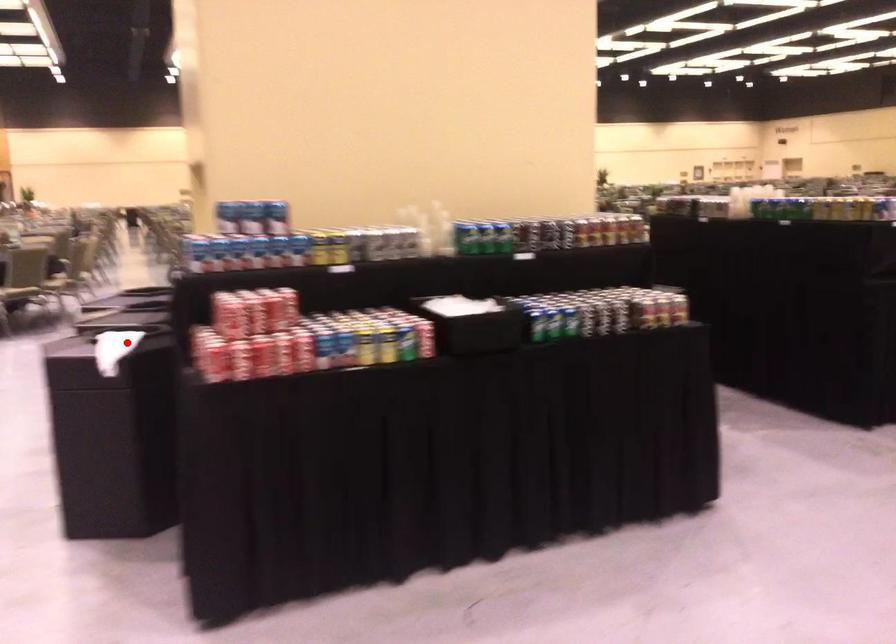
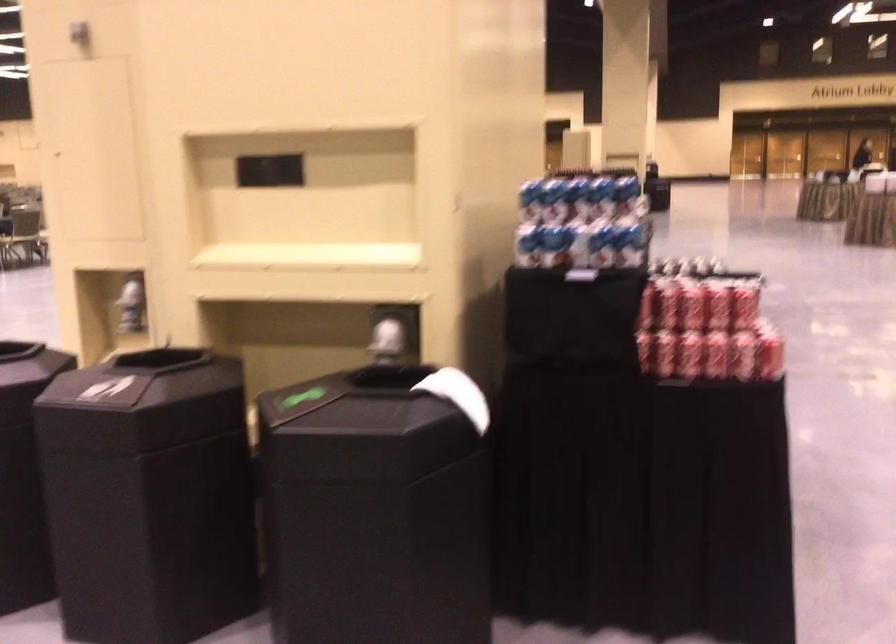
Question: I am providing you with two images of the same scene from different viewpoints. In image1, a red point is highlighted. Considering the same 3D point in image2, which of the following is correct?

Choices:
 (A) It is closer
 (B) It is farther

Answer: (A)